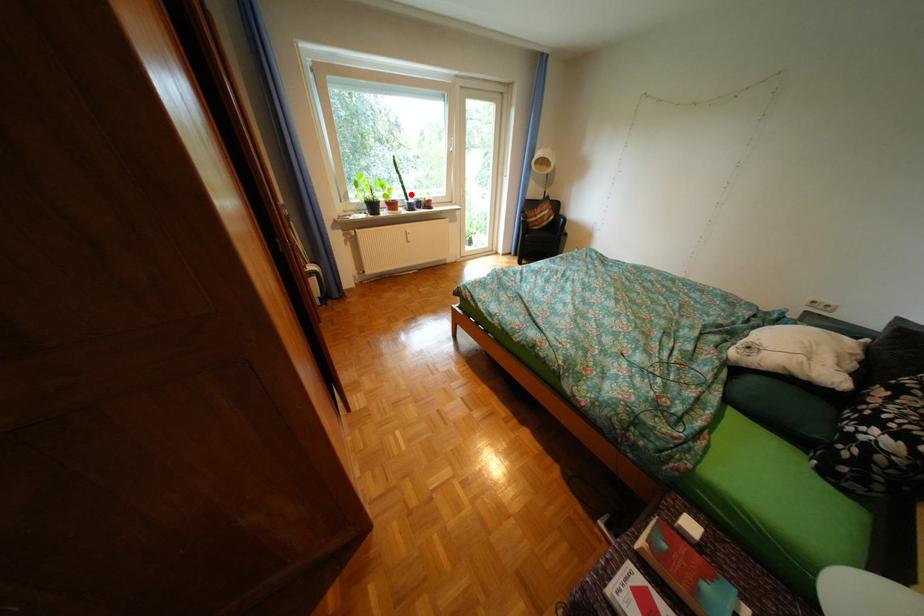
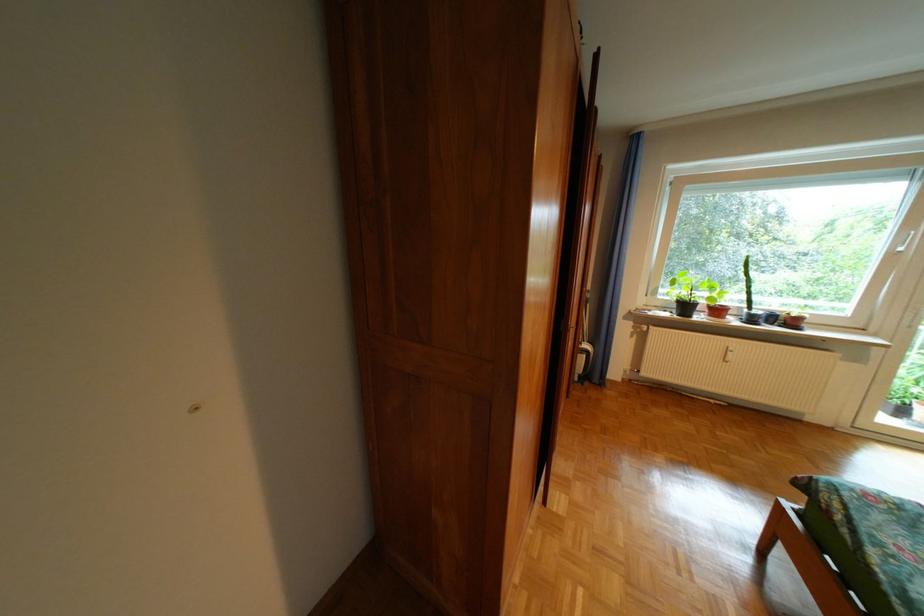
In the second image, find the point that corresponds to the highlighted location in the first image.

(747, 300)